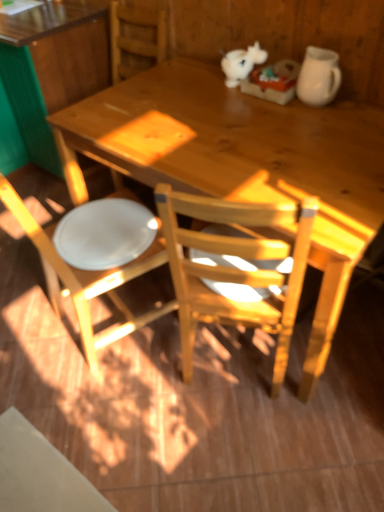
You are a GUI agent. You are given a task and a screenshot of the screen. Output one action in this format:
    pyautogui.click(x=<x>, y=<y>)
    Task: Click on the free location to the left of white matte chair at left
    The width and height of the screenshot is (384, 512).
    Given the screenshot: What is the action you would take?
    pyautogui.click(x=25, y=318)